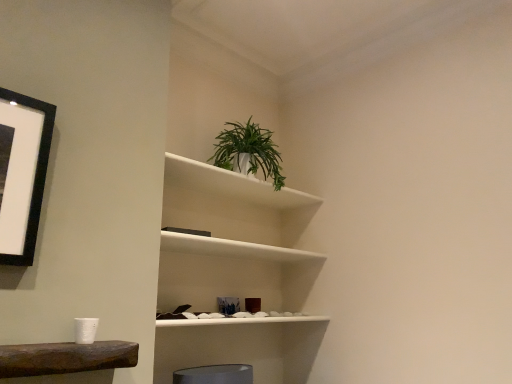
Measure the distance between point [172,345] and camera.

A distance of 1.90 meters exists between point [172,345] and camera.

This screenshot has height=384, width=512. What do you see at coordinates (233, 240) in the screenshot?
I see `white matte plant at upper center` at bounding box center [233, 240].

This screenshot has height=384, width=512. In order to click on white matte plant at upper center in this screenshot , I will do `click(233, 240)`.

Identify the location of green leafy plant in white pot at upper center. (249, 151).

Measure the distance between point (259, 153) and camera.

2.10 meters.

The image size is (512, 384). What do you see at coordinates (249, 151) in the screenshot? I see `green leafy plant in white pot at upper center` at bounding box center [249, 151].

In order to click on white matte plant at upper center in this screenshot , I will do `click(233, 240)`.

In the image, is green leafy plant in white pot at upper center on the left side or the right side of white matte plant at upper center?

From the image, it's evident that green leafy plant in white pot at upper center is to the right of white matte plant at upper center.

Considering the positions of objects green leafy plant in white pot at upper center and white matte plant at upper center in the image provided, who is in front, green leafy plant in white pot at upper center or white matte plant at upper center?

Positioned in front is white matte plant at upper center.

In the scene shown: Which is farther, (234, 155) or (278, 351)?

Positioned behind is point (278, 351).

From the image's perspective, is green leafy plant in white pot at upper center beneath white matte plant at upper center?

Incorrect, from the image's perspective, green leafy plant in white pot at upper center is higher than white matte plant at upper center.

From a real-world perspective, is green leafy plant in white pot at upper center positioned above or below white matte plant at upper center?

From a real-world perspective, green leafy plant in white pot at upper center is physically above white matte plant at upper center.

Which object is thinner, green leafy plant in white pot at upper center or white matte plant at upper center?

green leafy plant in white pot at upper center is thinner.

Can you confirm if green leafy plant in white pot at upper center is taller than white matte plant at upper center?

No.

Based on the photo, can you confirm if green leafy plant in white pot at upper center is bigger than white matte plant at upper center?

Actually, green leafy plant in white pot at upper center might be smaller than white matte plant at upper center.

Is green leafy plant in white pot at upper center not inside white matte plant at upper center?

green leafy plant in white pot at upper center is positioned outside white matte plant at upper center.

Would you say green leafy plant in white pot at upper center is a long distance from white matte plant at upper center?

No.

Is green leafy plant in white pot at upper center turned away from white matte plant at upper center?

green leafy plant in white pot at upper center does not have its back to white matte plant at upper center.

How different are the orientations of green leafy plant in white pot at upper center and white matte plant at upper center in degrees?

They differ by 1.41 degrees in their facing directions.

Find the location of a particular element. The height and width of the screenshot is (384, 512). houseplant that is above the white matte plant at upper center (from a real-world perspective) is located at coordinates (249, 151).

Which object is positioned more to the right, white matte plant at upper center or green leafy plant in white pot at upper center?

green leafy plant in white pot at upper center is more to the right.

Considering the relative positions of white matte plant at upper center and green leafy plant in white pot at upper center in the image provided, is white matte plant at upper center in front of green leafy plant in white pot at upper center?

That is True.

Which point is more distant from viewer, [288,333] or [267,161]?

The point [288,333] is behind.

From the image's perspective, is white matte plant at upper center located above or below green leafy plant in white pot at upper center?

white matte plant at upper center is below green leafy plant in white pot at upper center.

From a real-world perspective, relative to green leafy plant in white pot at upper center, is white matte plant at upper center vertically above or below?

white matte plant at upper center is situated lower than green leafy plant in white pot at upper center in the real world.

In terms of width, does white matte plant at upper center look wider or thinner when compared to green leafy plant in white pot at upper center?

In the image, white matte plant at upper center appears to be wider than green leafy plant in white pot at upper center.

Can you confirm if white matte plant at upper center is shorter than green leafy plant in white pot at upper center?

No, white matte plant at upper center is not shorter than green leafy plant in white pot at upper center.

In terms of size, does white matte plant at upper center appear bigger or smaller than green leafy plant in white pot at upper center?

Clearly, white matte plant at upper center is larger in size than green leafy plant in white pot at upper center.

Is white matte plant at upper center not inside green leafy plant in white pot at upper center?

Yes, white matte plant at upper center is not within green leafy plant in white pot at upper center.

Is white matte plant at upper center far from green leafy plant in white pot at upper center?

No, there isn't a large distance between white matte plant at upper center and green leafy plant in white pot at upper center.

Could you tell me if white matte plant at upper center is turned towards green leafy plant in white pot at upper center?

No, white matte plant at upper center is not oriented towards green leafy plant in white pot at upper center.

Consider the image. Can you tell me how much white matte plant at upper center and green leafy plant in white pot at upper center differ in facing direction?

They differ by 1.41 degrees in their facing directions.

The height and width of the screenshot is (384, 512). Find the location of `houseplant that appears behind the white matte plant at upper center`. houseplant that appears behind the white matte plant at upper center is located at coordinates coord(249,151).

Locate an element on the screen. The height and width of the screenshot is (384, 512). shelf located in front of the green leafy plant in white pot at upper center is located at coordinates (233, 240).

Where is `houseplant behind the white matte plant at upper center`? houseplant behind the white matte plant at upper center is located at coordinates (249, 151).